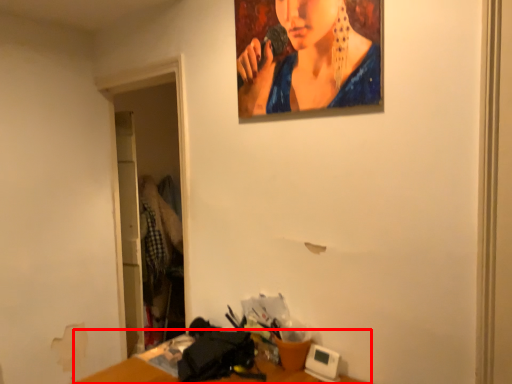
Question: From the image's perspective, what is the correct spatial relationship of table (annotated by the red box) in relation to person?

Choices:
 (A) below
 (B) above

Answer: (A)